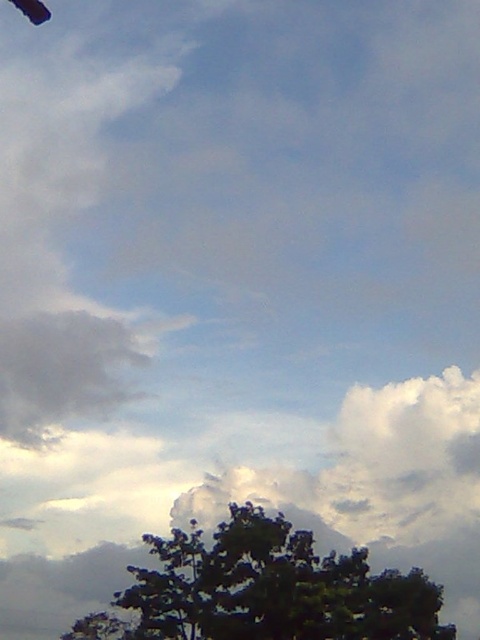
Does green leafy tree at lower center appear on the left side of dark blue fabric parachute at upper left?

In fact, green leafy tree at lower center is to the right of dark blue fabric parachute at upper left.

Locate an element on the screen. green leafy tree at lower center is located at coordinates (265, 589).